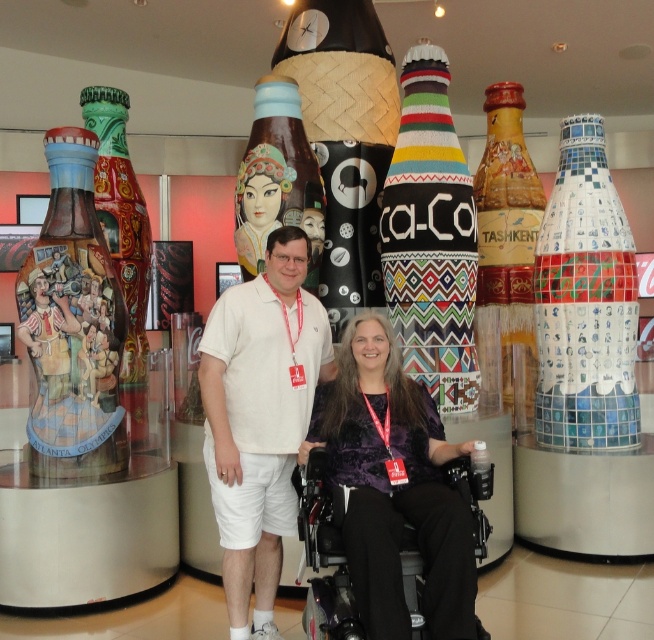
Between point (362, 83) and point (247, 157), which one is positioned in front?

Point (247, 157)

Describe the element at coordinates (345, 138) in the screenshot. I see `matte black bottle at center` at that location.

Does point (296, 80) lie in front of point (239, 186)?

No, it is behind (239, 186).

Find the location of a particular element. This screenshot has height=640, width=654. matte black bottle at center is located at coordinates (345, 138).

Which is behind, point (557, 240) or point (445, 144)?

Point (557, 240)

Describe the element at coordinates (585, 301) in the screenshot. I see `mosaic glass bottle at right` at that location.

The image size is (654, 640). In order to click on mosaic glass bottle at right in this screenshot , I will do `click(585, 301)`.

Is matte painted bottle at left smaller than matte black bottle at center?

Correct, matte painted bottle at left occupies less space than matte black bottle at center.

Who is higher up, matte painted bottle at left or matte black bottle at center?

matte black bottle at center is higher up.

Who is more distant from viewer, (44, 326) or (332, 237)?

The point (332, 237) is more distant.

The image size is (654, 640). I want to click on matte painted bottle at left, so click(73, 324).